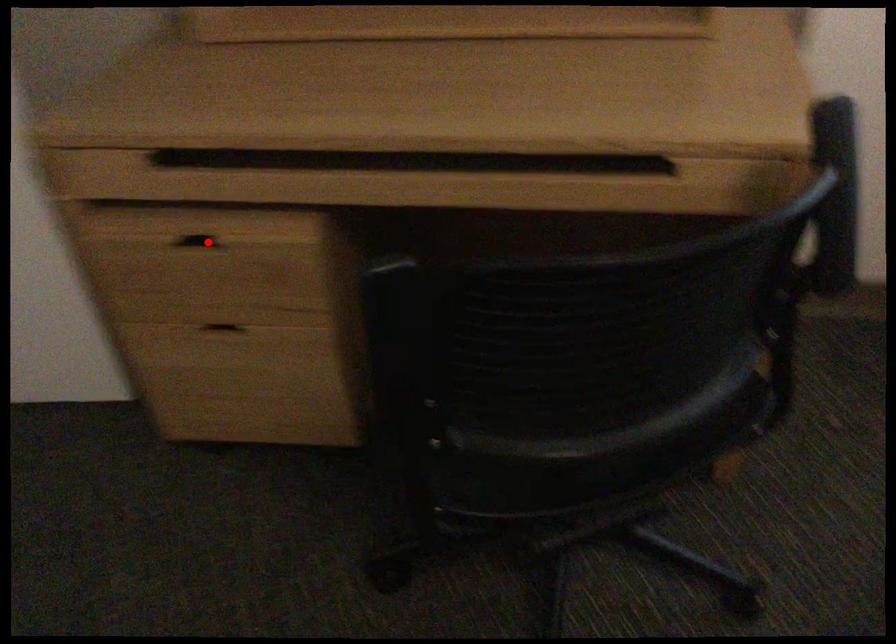
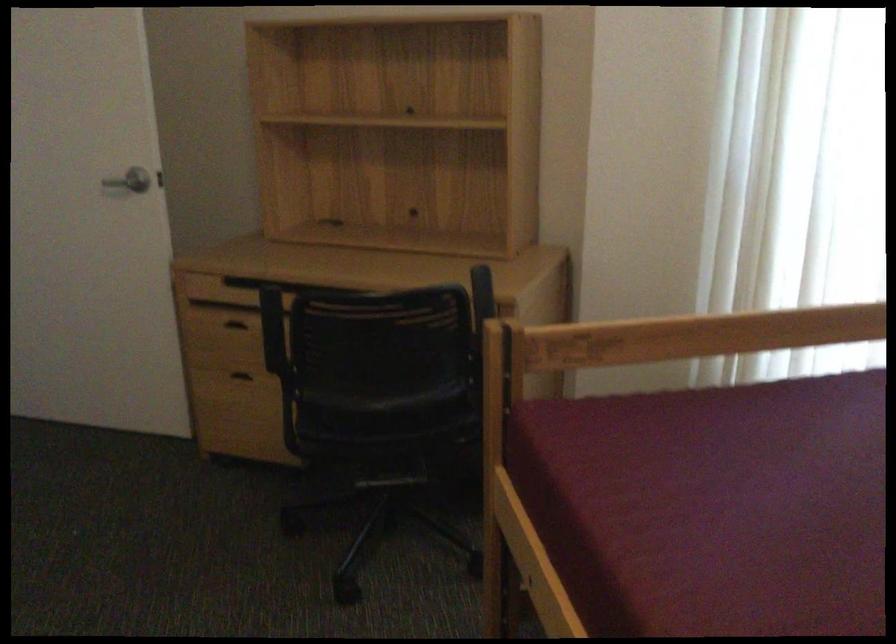
The point at the highlighted location is marked in the first image. Where is the corresponding point in the second image?

(240, 323)